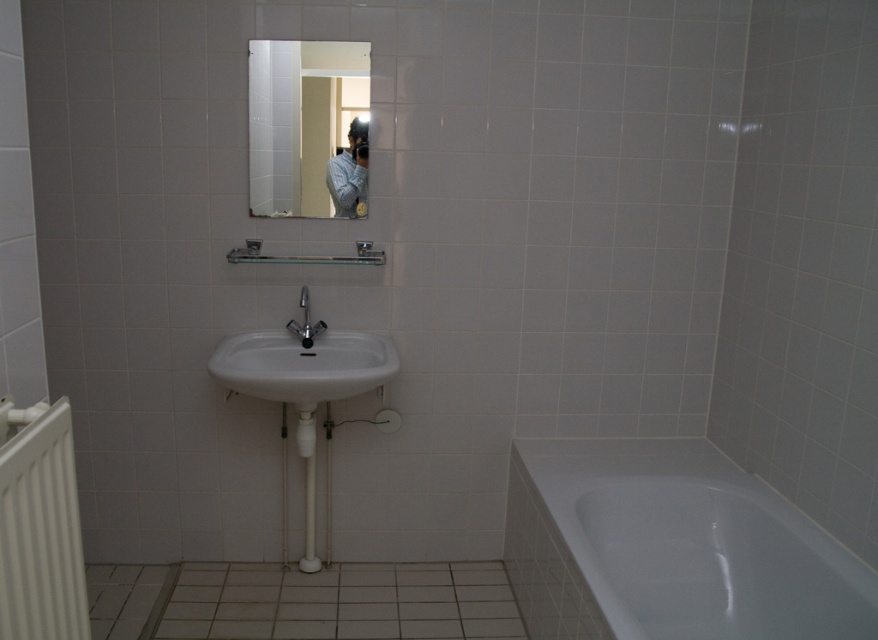
Question: Can you confirm if white glossy bathtub at lower right is wider than white glossy sink at center?

Choices:
 (A) no
 (B) yes

Answer: (B)

Question: Based on their relative distances, which object is nearer to the white matte radiator at lower left?

Choices:
 (A) matte silver faucet at center
 (B) blue textured shirt at upper center
 (C) clear glass mirror at upper center
 (D) white glossy bathtub at lower right

Answer: (A)

Question: Which of these objects is positioned farthest from the white glossy bathtub at lower right?

Choices:
 (A) matte silver faucet at center
 (B) clear glass mirror at upper center
 (C) blue textured shirt at upper center

Answer: (B)

Question: Which point is farther to the camera?

Choices:
 (A) blue textured shirt at upper center
 (B) white matte radiator at lower left

Answer: (A)

Question: Can you confirm if clear glass mirror at upper center is bigger than white matte radiator at lower left?

Choices:
 (A) no
 (B) yes

Answer: (B)

Question: Does white glossy sink at center have a larger size compared to matte silver faucet at center?

Choices:
 (A) no
 (B) yes

Answer: (B)